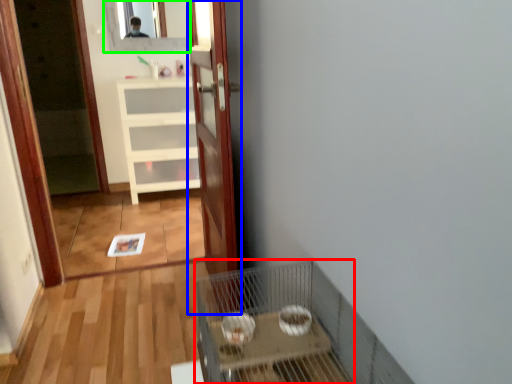
Question: Estimate the real-world distances between objects in this image. Which object is closer to cage (highlighted by a red box), door (highlighted by a blue box) or mirror (highlighted by a green box)?

Choices:
 (A) door
 (B) mirror

Answer: (A)